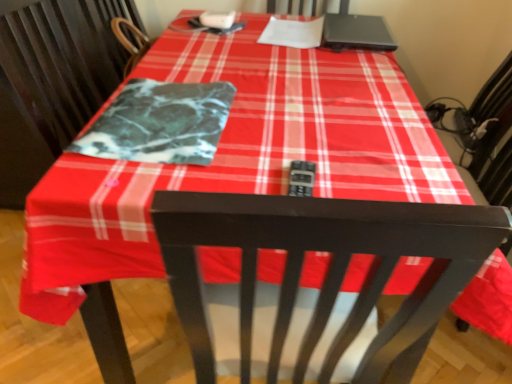
Question: From their relative heights in the image, would you say marble-like fabric at center is taller or shorter than black matte laptop at upper right?

Choices:
 (A) tall
 (B) short

Answer: (B)

Question: From the image's perspective, is marble-like fabric at center above or below black matte laptop at upper right?

Choices:
 (A) below
 (B) above

Answer: (A)

Question: Is point (144, 127) closer or farther from the camera than point (357, 23)?

Choices:
 (A) closer
 (B) farther

Answer: (A)

Question: From the image's perspective, is black matte laptop at upper right located above or below marble-like fabric at center?

Choices:
 (A) below
 (B) above

Answer: (B)

Question: From a real-world perspective, is black matte laptop at upper right positioned above or below marble-like fabric at center?

Choices:
 (A) below
 (B) above

Answer: (B)

Question: From their relative heights in the image, would you say black matte laptop at upper right is taller or shorter than marble-like fabric at center?

Choices:
 (A) tall
 (B) short

Answer: (A)

Question: In terms of size, does black matte laptop at upper right appear bigger or smaller than marble-like fabric at center?

Choices:
 (A) small
 (B) big

Answer: (B)